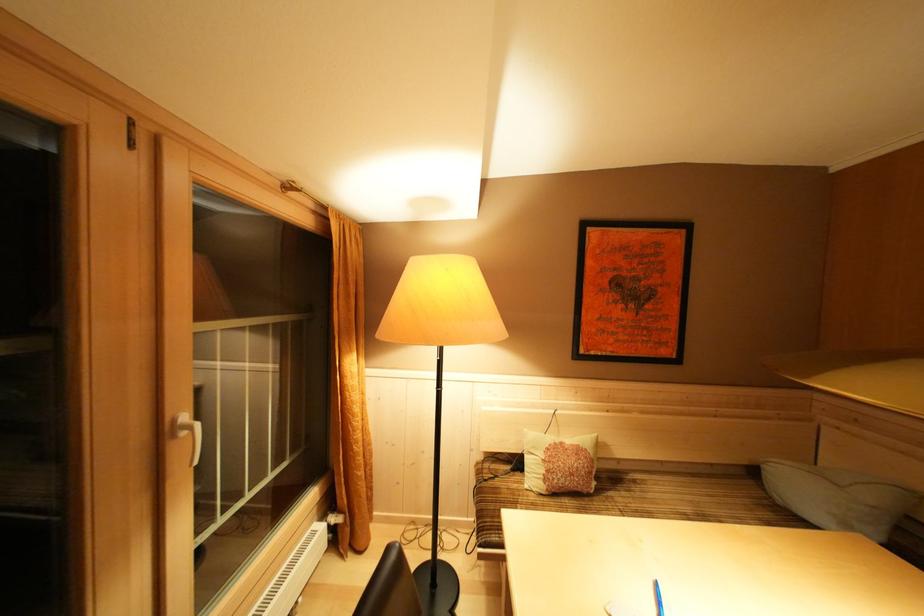
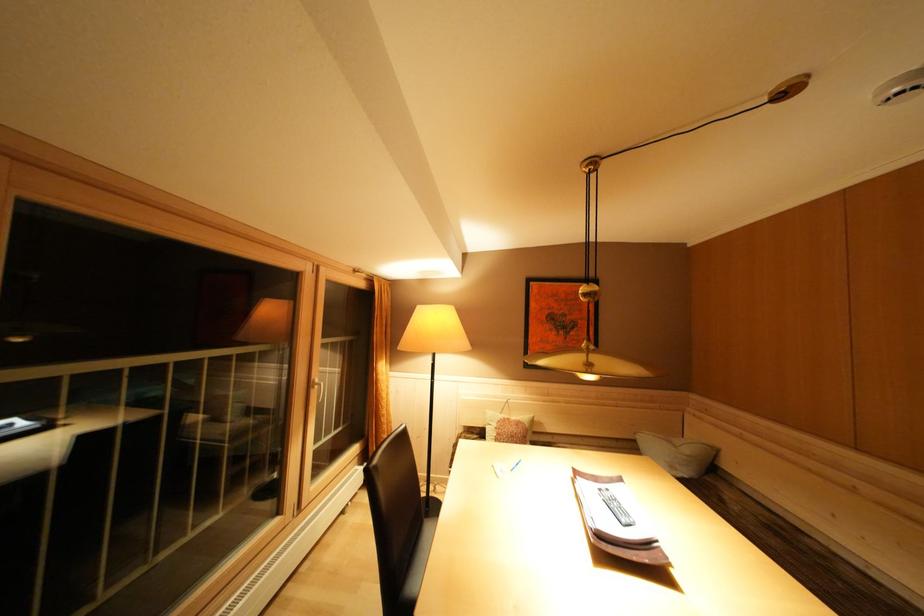
Where in the second image is the point corresponding to point 879,503 from the first image?

(695, 456)